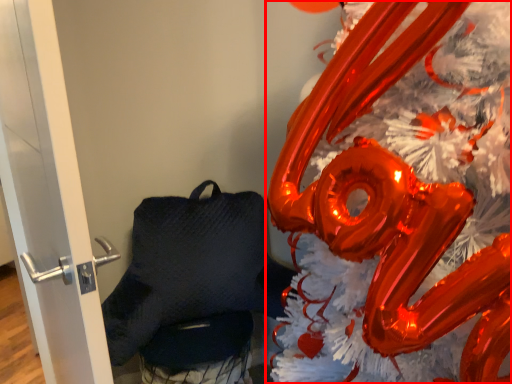
Question: From the image, what is the correct spatial relationship of christmas decoration (annotated by the red box) in relation to door?

Choices:
 (A) left
 (B) right

Answer: (B)